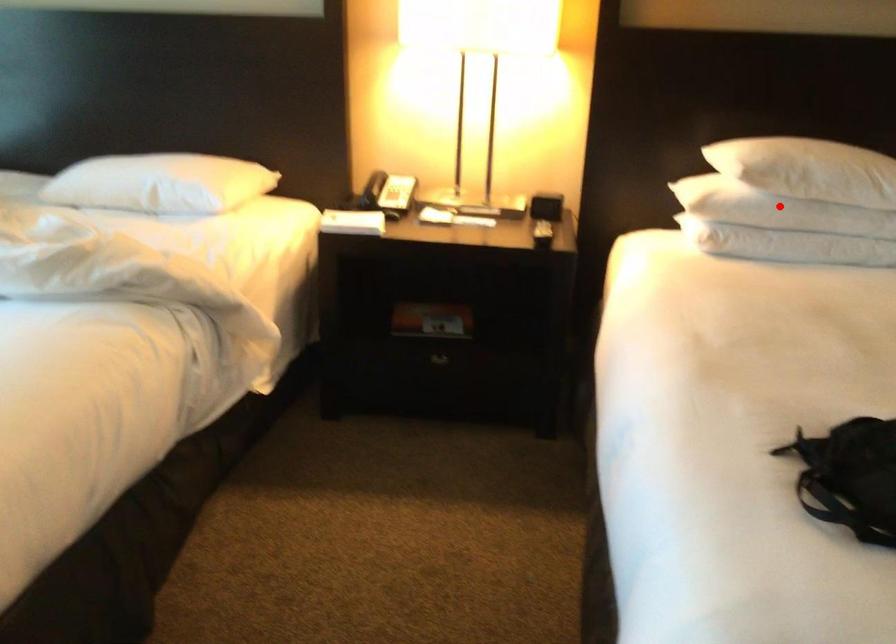
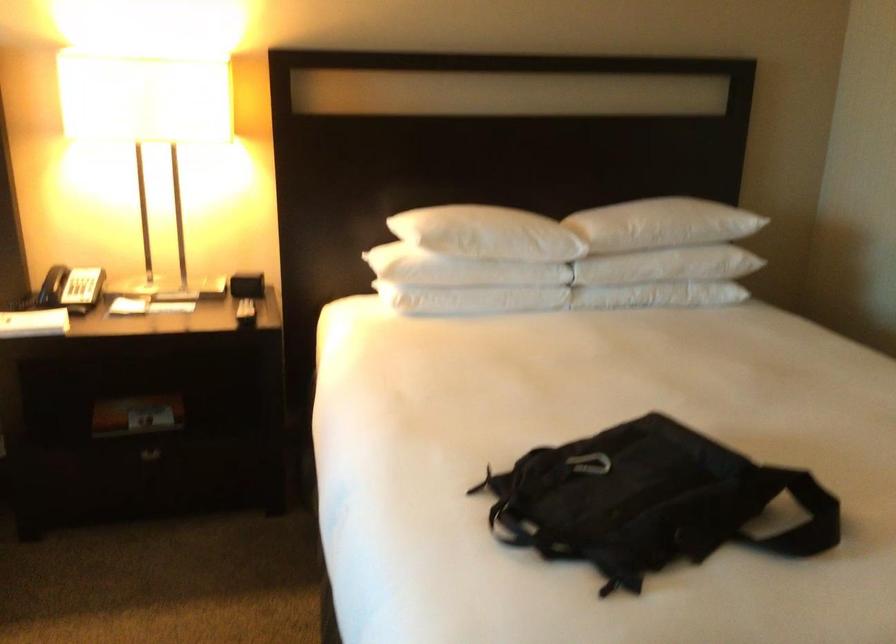
The point at the highlighted location is marked in the first image. Where is the corresponding point in the second image?

(460, 270)